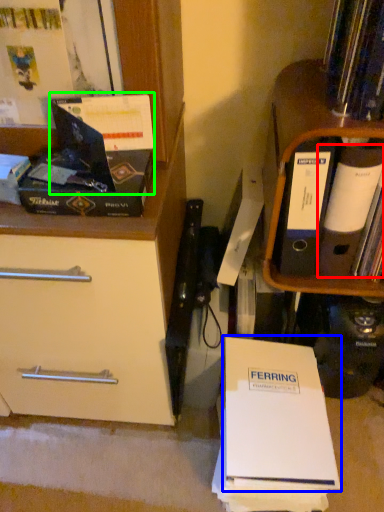
Question: Which object is positioned farthest from paperback book (highlighted by a red box)? Select from paperback book (highlighted by a blue box) and paperback book (highlighted by a green box).

Choices:
 (A) paperback book
 (B) paperback book

Answer: (B)